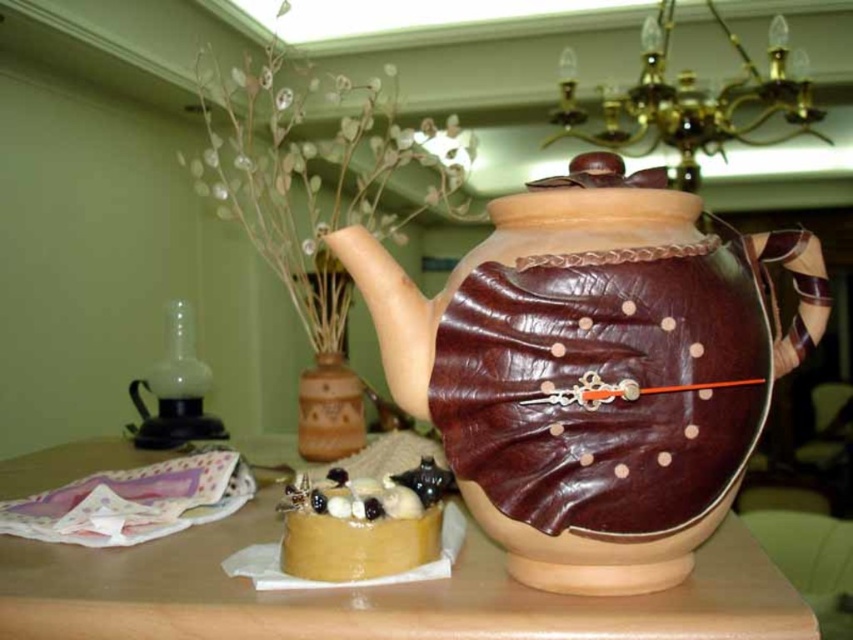
From the picture: You are a guest at a tea party and want to pour tea from the brown leather teapot at center into the smooth caramel cake at lower left. Is the teapot large enough to hold enough tea to fill the cake?

The brown leather teapot at center has a larger size compared to smooth caramel cake at lower left, so it is likely capable of holding enough tea to fill the cake.

You are a guest at a tea party and see the brown leather teapot at center and the smooth caramel cake at lower left on the table. Which item is positioned higher on the table?

The brown leather teapot at center is above the smooth caramel cake at lower left, so it is positioned higher on the table.